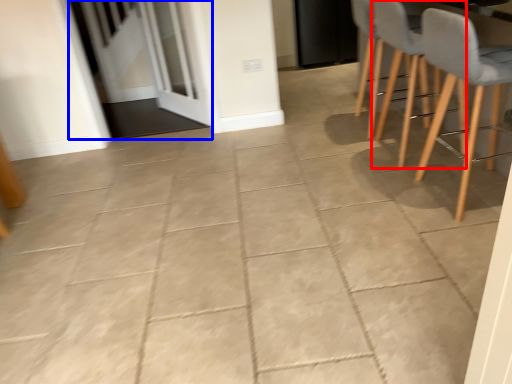
Question: Among these objects, which one is nearest to the camera, armchair (highlighted by a red box) or screen door (highlighted by a blue box)?

Choices:
 (A) armchair
 (B) screen door

Answer: (A)